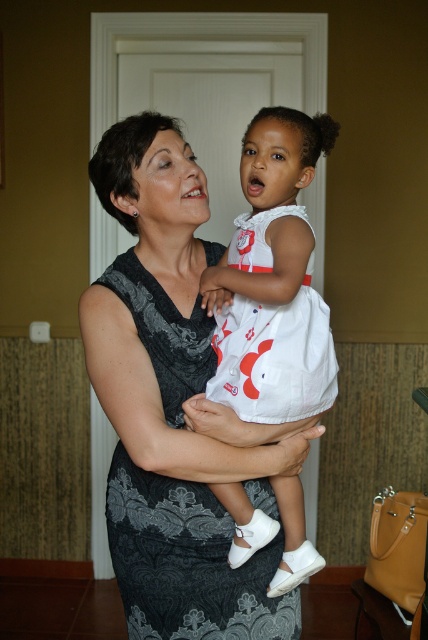
You are organizing a clothing display and need to arrange the white satin dress at center and the black lace dress at center based on their positions. Which dress is located to the right of the other?

The white satin dress at center is positioned on the right side of black lace dress at center.

You are an assistant organizing a clothing display. You have two dresses in front of you, the white satin dress at center and the black lace dress at center. The customer wants to know which dress is more visible to them from their current position. Which one should you tell them?

The white satin dress at center is closer to the viewer than the black lace dress at center, so it is more visible from the customer current position.

You are standing at point (178, 353) and want to walk to the door in the background. Is the point (297, 506) between you and the door?

Point (297, 506) is behind point (178, 353), so it is not between you and the door. You can walk towards the door without obstruction from that point.